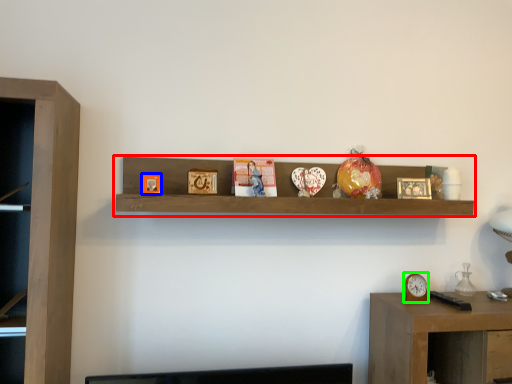
Question: Based on their relative distances, which object is farther from shelf (highlighted by a red box)? Choose from picture frame (highlighted by a blue box) and clock (highlighted by a green box).

Choices:
 (A) picture frame
 (B) clock

Answer: (B)